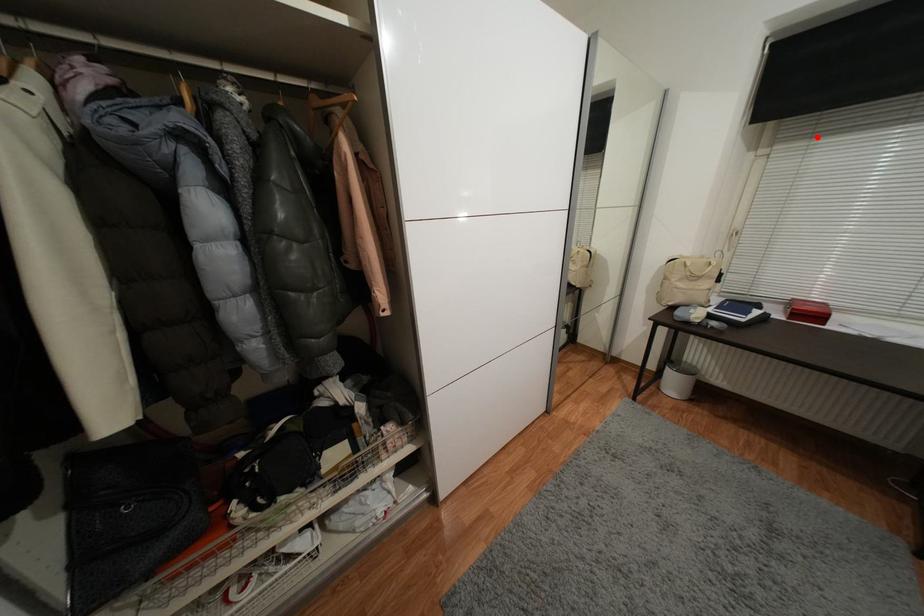
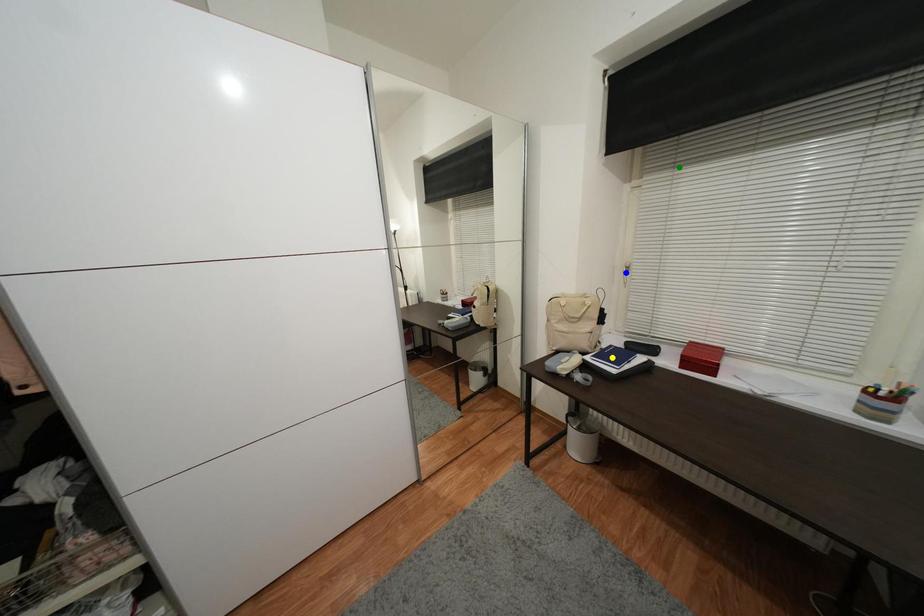
Question: I am providing you with two images of the same scene from different viewpoints. A red point is marked on the first image. You are given multiple points on the second image. Which spot in image 2 lines up with the point in image 1?

Choices:
 (A) yellow point
 (B) blue point
 (C) green point

Answer: (C)